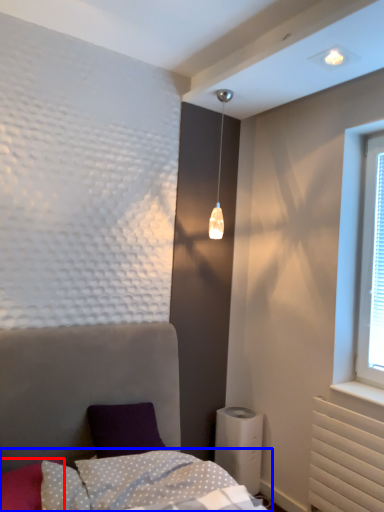
Question: Which object is further to the camera taking this photo, pillow (highlighted by a red box) or bedding (highlighted by a blue box)?

Choices:
 (A) pillow
 (B) bedding

Answer: (A)